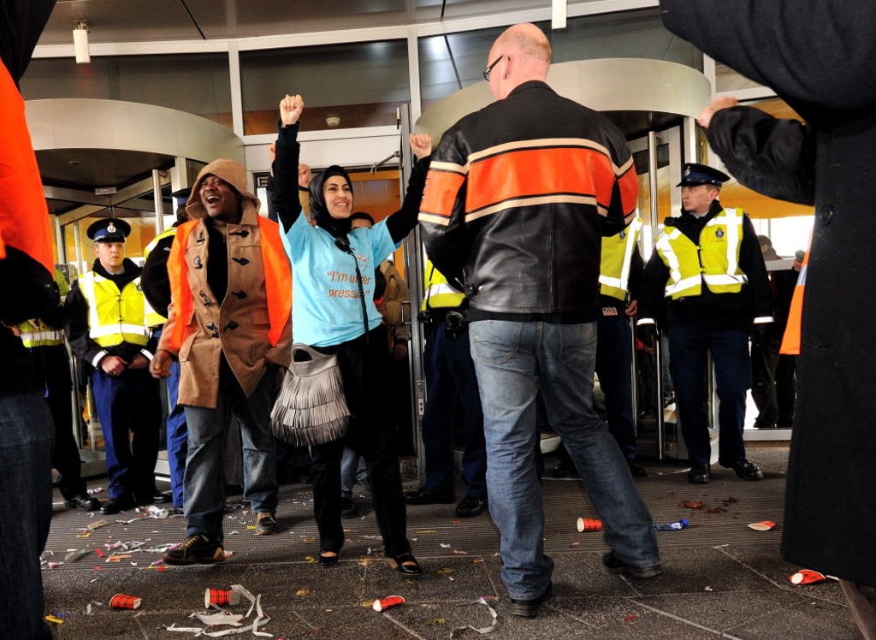
Can you confirm if light blue jersey at center is taller than high-visibility yellow safety vest at left?

Yes, light blue jersey at center is taller than high-visibility yellow safety vest at left.

Does light blue jersey at center come in front of high-visibility yellow safety vest at left?

Yes, light blue jersey at center is closer to the viewer.

I want to click on light blue jersey at center, so click(345, 326).

Which is more to the right, high-visibility yellow safety vest at center-right or high-visibility yellow safety vest at left?

high-visibility yellow safety vest at center-right is more to the right.

How far apart are high-visibility yellow safety vest at center-right and high-visibility yellow safety vest at left?

They are 2.81 meters apart.

Is point (696, 292) behind point (143, 317)?

No, it is in front of (143, 317).

Locate an element on the screen. Image resolution: width=876 pixels, height=640 pixels. high-visibility yellow safety vest at center-right is located at coordinates (703, 257).

Between leather jacket at center and high-visibility yellow safety vest at left, which one has less height?

high-visibility yellow safety vest at left

Is leather jacket at center closer to camera compared to high-visibility yellow safety vest at left?

That is True.

Where is `leather jacket at center`? This screenshot has width=876, height=640. leather jacket at center is located at coordinates (535, 296).